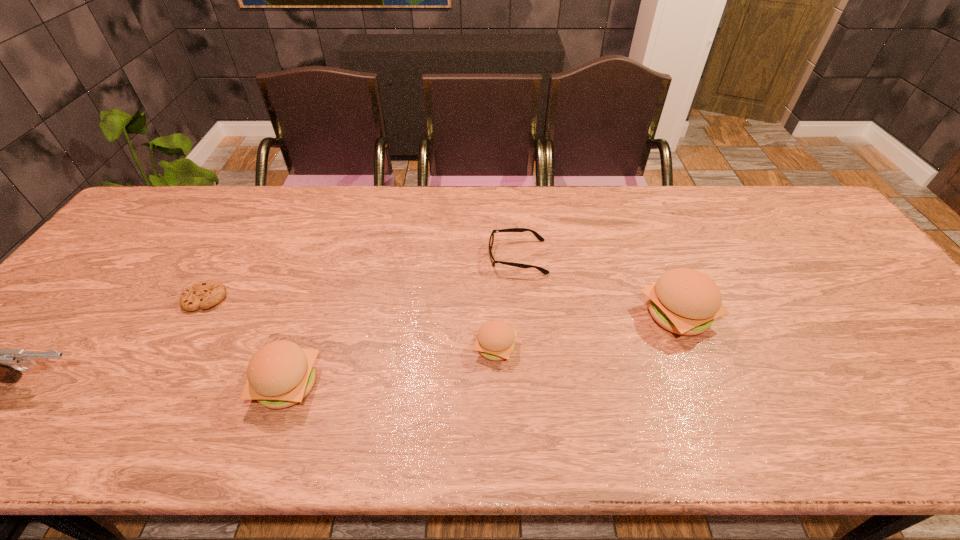
The height and width of the screenshot is (540, 960). Find the location of `free space for a new hamburger on the right`. free space for a new hamburger on the right is located at coordinates (839, 286).